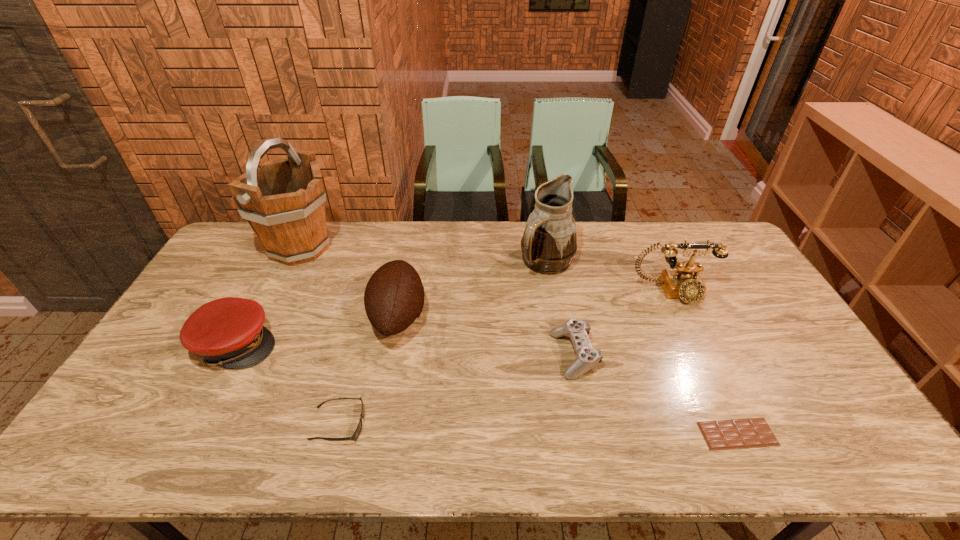
The width and height of the screenshot is (960, 540). In order to click on bucket that is positioned at the left edge in this screenshot , I will do `click(283, 200)`.

Where is `cap situated at the left edge`? The height and width of the screenshot is (540, 960). cap situated at the left edge is located at coordinates (228, 332).

Identify the location of object present at the right edge. Image resolution: width=960 pixels, height=540 pixels. (684, 282).

Find the location of a particular element. Image resolution: width=960 pixels, height=540 pixels. object situated at the far left corner is located at coordinates (283, 200).

In the image, there is a desktop. Identify the location of free space at the far edge. This screenshot has height=540, width=960. (466, 221).

In order to click on free space at the near edge of the desktop in this screenshot , I will do `click(268, 441)`.

The image size is (960, 540). In order to click on free spot at the left edge of the desktop in this screenshot , I will do `click(187, 357)`.

The image size is (960, 540). I want to click on vacant space at the far left corner, so [x=252, y=256].

What are the coordinates of `vacant region at the near left corner of the desktop` in the screenshot? It's located at (98, 434).

Image resolution: width=960 pixels, height=540 pixels. I want to click on vacant space at the far right corner of the desktop, so click(710, 237).